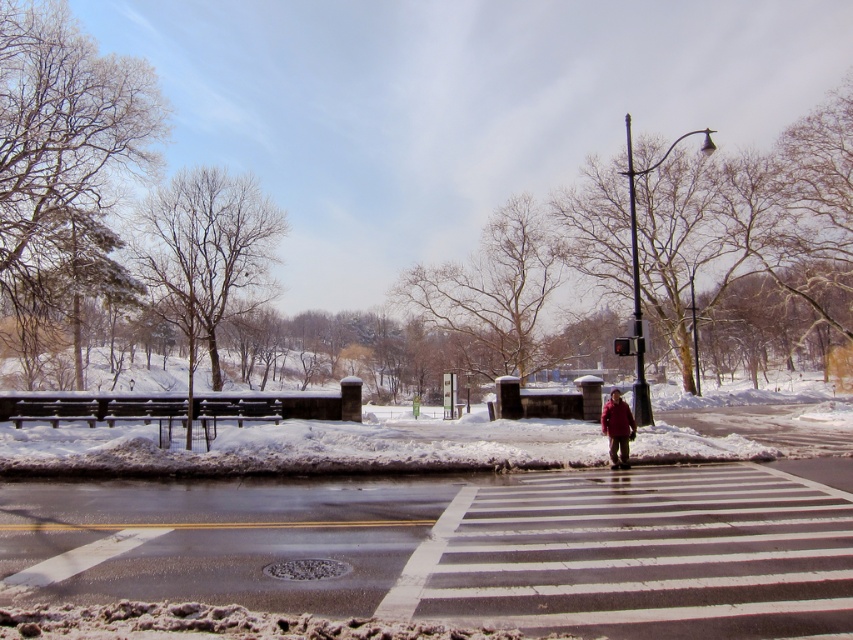
Question: Which object is positioned closest to the red wool coat at crosswalk?

Choices:
 (A) white painted crosswalk at center
 (B) red glass traffic light at center

Answer: (B)

Question: Among these objects, which one is farthest from the camera?

Choices:
 (A) red glass traffic light at center
 (B) red wool coat at crosswalk

Answer: (A)

Question: Which point is closer to the camera?

Choices:
 (A) white painted crosswalk at center
 (B) red wool coat at crosswalk

Answer: (A)

Question: Is red wool coat at crosswalk positioned behind red glass traffic light at center?

Choices:
 (A) yes
 (B) no

Answer: (B)

Question: Does red wool coat at crosswalk appear on the left side of red glass traffic light at center?

Choices:
 (A) no
 (B) yes

Answer: (B)

Question: From the image, what is the correct spatial relationship of red wool coat at crosswalk in relation to red glass traffic light at center?

Choices:
 (A) left
 (B) right

Answer: (A)